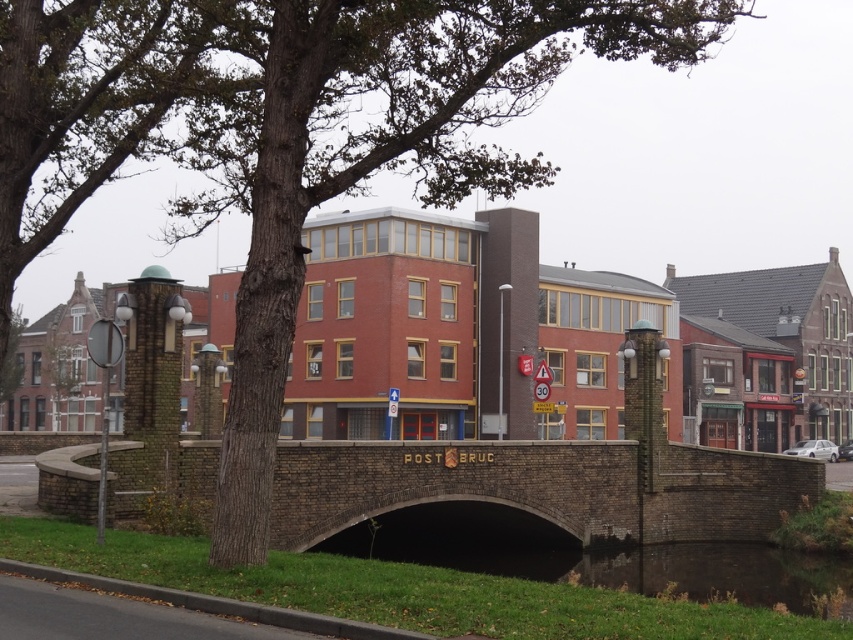
You are standing at the point with coordinates point (831, 573) and want to walk towards the point (554, 456). Will the brick bridge obstruct your path?

Point (554, 456) is behind point (831, 573), so the brick bridge will not obstruct your path because you are already in front of the point you want to reach.

You are a tourist standing on the brown stone bridge at center and want to take a photo of the dark green grass at lower center. Which direction should you face to capture the grass in your shot?

You should face downward since the brown stone bridge at center is in front of dark green grass at lower center, meaning the grass is located below the bridge.

Based on the photo, you are standing on the dark green grass at lower center and want to cross to the other side of the waterway. Which direction should you walk to reach the brown stone bridge at center?

You should walk to the left since the brown stone bridge at center is located to the left of the dark green grass at lower center.